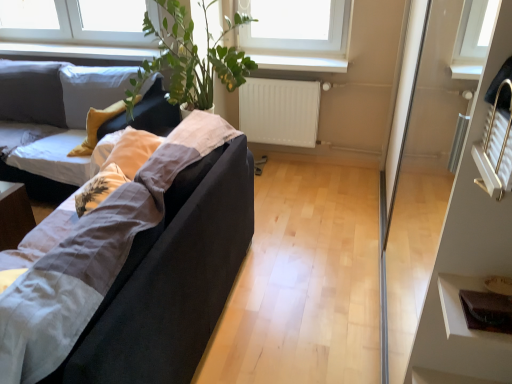
The width and height of the screenshot is (512, 384). I want to click on matte black couch at left, which is counted as the first studio couch, starting from the front, so click(95, 255).

Identify the location of matte black couch at left, the 2th studio couch when ordered from front to back. (33, 94).

Considering the points (302, 97) and (9, 333), which point is in front, point (302, 97) or point (9, 333)?

Positioned in front is point (9, 333).

From a real-world perspective, does white matte radiator at center sit lower than matte black couch at left, which ranks as the second studio couch in back-to-front order?

Correct, in the physical world, white matte radiator at center is lower than matte black couch at left, which ranks as the second studio couch in back-to-front order.

Is white matte radiator at center taller than matte black couch at left, which is counted as the first studio couch, starting from the front?

No.

Is white matte radiator at center looking in the opposite direction of matte black couch at left, which is counted as the first studio couch, starting from the front?

white matte radiator at center is not turned away from matte black couch at left, which is counted as the first studio couch, starting from the front.

Find the location of a particular element. This screenshot has width=512, height=384. glass door on the right of matte black couch at left, the 2th studio couch when ordered from front to back is located at coordinates (449, 260).

Considering the sizes of objects matte black couch at left, marked as the first studio couch in a back-to-front arrangement, and transparent glass door at right in the image provided, who is bigger, matte black couch at left, marked as the first studio couch in a back-to-front arrangement, or transparent glass door at right?

matte black couch at left, marked as the first studio couch in a back-to-front arrangement, is bigger.

Can we say matte black couch at left, marked as the first studio couch in a back-to-front arrangement, lies outside transparent glass door at right?

That's correct, matte black couch at left, marked as the first studio couch in a back-to-front arrangement, is outside of transparent glass door at right.

Which object is further away from the camera, matte black couch at left, the 2th studio couch when ordered from front to back, or transparent glass door at right?

matte black couch at left, the 2th studio couch when ordered from front to back, is further away from the camera.

Does matte black couch at left, which ranks as the second studio couch in back-to-front order, turn towards white matte radiator at center?

No, matte black couch at left, which ranks as the second studio couch in back-to-front order, is not facing towards white matte radiator at center.

From the picture: Are matte black couch at left, which is counted as the first studio couch, starting from the front, and white matte radiator at center located far from each other?

Yes, matte black couch at left, which is counted as the first studio couch, starting from the front, is far from white matte radiator at center.

Between matte black couch at left, which ranks as the second studio couch in back-to-front order, and white matte radiator at center, which one has smaller size?

Smaller between the two is white matte radiator at center.

Is white matte radiator at center inside matte black couch at left, which is counted as the first studio couch, starting from the front?

No, white matte radiator at center is not inside matte black couch at left, which is counted as the first studio couch, starting from the front.

Based on their sizes in the image, would you say white plastic window sill at upper center is bigger or smaller than brown leather wallet at lower right?

Considering their sizes, white plastic window sill at upper center takes up more space than brown leather wallet at lower right.

From the image's perspective, between white plastic window sill at upper center and brown leather wallet at lower right, who is located below?

From the image's view, brown leather wallet at lower right is below.

Where is `shelf that is on the right side of white plastic window sill at upper center`? shelf that is on the right side of white plastic window sill at upper center is located at coordinates (460, 306).

Considering the positions of point (292, 64) and point (474, 337), is point (292, 64) closer or farther from the camera than point (474, 337)?

Point (292, 64) is farther from the camera than point (474, 337).

From a real-world perspective, is white plastic window sill at upper center physically located above or below matte black couch at left, which ranks as the second studio couch in back-to-front order?

In terms of real-world spatial position, white plastic window sill at upper center is above matte black couch at left, which ranks as the second studio couch in back-to-front order.

Is white plastic window sill at upper center far away from matte black couch at left, which ranks as the second studio couch in back-to-front order?

Yes.

From the image's perspective, does white plastic window sill at upper center appear higher than matte black couch at left, which ranks as the second studio couch in back-to-front order?

Yes, from the image's perspective, white plastic window sill at upper center is above matte black couch at left, which ranks as the second studio couch in back-to-front order.

Can we say white plastic window sill at upper center lies outside matte black couch at left, which is counted as the first studio couch, starting from the front?

Yes, white plastic window sill at upper center is located beyond the bounds of matte black couch at left, which is counted as the first studio couch, starting from the front.

In terms of size, does transparent glass door at right appear bigger or smaller than brown leather wallet at lower right?

Considering their sizes, transparent glass door at right takes up more space than brown leather wallet at lower right.

Would you say transparent glass door at right is outside brown leather wallet at lower right?

Yes, transparent glass door at right is not within brown leather wallet at lower right.

Does point (492, 249) appear closer or farther from the camera than point (509, 338)?

Point (492, 249) is positioned farther from the camera compared to point (509, 338).

Between transparent glass door at right and brown leather wallet at lower right, which one is positioned in front?

transparent glass door at right is in front.

Which of these two, matte black couch at left, marked as the first studio couch in a back-to-front arrangement, or white matte radiator at center, is bigger?

Bigger between the two is matte black couch at left, marked as the first studio couch in a back-to-front arrangement.

Based on their positions, is matte black couch at left, the 2th studio couch when ordered from front to back, located to the left or right of white matte radiator at center?

matte black couch at left, the 2th studio couch when ordered from front to back, is positioned on white matte radiator at center's left side.

Are matte black couch at left, the 2th studio couch when ordered from front to back, and white matte radiator at center making contact?

No.

Consider the image. Which object is more forward, matte black couch at left, the 2th studio couch when ordered from front to back, or white matte radiator at center?

matte black couch at left, the 2th studio couch when ordered from front to back, is closer to the camera.

The height and width of the screenshot is (384, 512). I want to click on radiator behind the matte black couch at left, which ranks as the second studio couch in back-to-front order, so click(279, 111).

The height and width of the screenshot is (384, 512). Identify the location of glass door that is on the right side of matte black couch at left, the 2th studio couch when ordered from front to back. (449, 260).

When comparing their distances from brown leather wallet at lower right, does matte black couch at left, marked as the first studio couch in a back-to-front arrangement, or transparent glass door at right seem further?

Among the two, matte black couch at left, marked as the first studio couch in a back-to-front arrangement, is located further to brown leather wallet at lower right.

Based on their spatial positions, is matte black couch at left, which ranks as the second studio couch in back-to-front order, or transparent glass door at right closer to brown leather wallet at lower right?

Based on the image, matte black couch at left, which ranks as the second studio couch in back-to-front order, appears to be nearer to brown leather wallet at lower right.

Considering their positions, is brown leather wallet at lower right positioned further to white plastic window sill at upper center than transparent glass door at right?

Based on the image, brown leather wallet at lower right appears to be further to white plastic window sill at upper center.

Considering their positions, is white matte radiator at center positioned closer to brown leather wallet at lower right than matte black couch at left, marked as the first studio couch in a back-to-front arrangement?

white matte radiator at center is closer to brown leather wallet at lower right.

Considering their positions, is matte black couch at left, marked as the first studio couch in a back-to-front arrangement, positioned further to white plastic window sill at upper center than transparent glass door at right?

Among the two, matte black couch at left, marked as the first studio couch in a back-to-front arrangement, is located further to white plastic window sill at upper center.

Considering their positions, is white plastic window sill at upper center positioned further to matte black couch at left, marked as the first studio couch in a back-to-front arrangement, than white matte radiator at center?

white plastic window sill at upper center.

From the image, which object appears to be farther from white plastic window sill at upper center, matte black couch at left, which is counted as the first studio couch, starting from the front, or brown leather wallet at lower right?

brown leather wallet at lower right.

From the image, which object appears to be nearer to transparent glass door at right, white plastic window sill at upper center or brown leather wallet at lower right?

white plastic window sill at upper center is closer to transparent glass door at right.

At what (x,y) coordinates should I click in order to perform the action: click on window sill between brown leather wallet at lower right and white matte radiator at center from front to back. Please return your answer as a coordinate pair (x, y). The image size is (512, 384). Looking at the image, I should click on (300, 63).

Locate an element on the screen. This screenshot has height=384, width=512. radiator between matte black couch at left, the 2th studio couch when ordered from front to back, and brown leather wallet at lower right, in the horizontal direction is located at coordinates (279, 111).

Identify the location of radiator between matte black couch at left, the 2th studio couch when ordered from front to back, and white plastic window sill at upper center, in the horizontal direction. This screenshot has height=384, width=512. (279, 111).

This screenshot has width=512, height=384. Find the location of `shelf between matte black couch at left, which is counted as the first studio couch, starting from the front, and white matte radiator at center, along the z-axis`. shelf between matte black couch at left, which is counted as the first studio couch, starting from the front, and white matte radiator at center, along the z-axis is located at coordinates (460, 306).